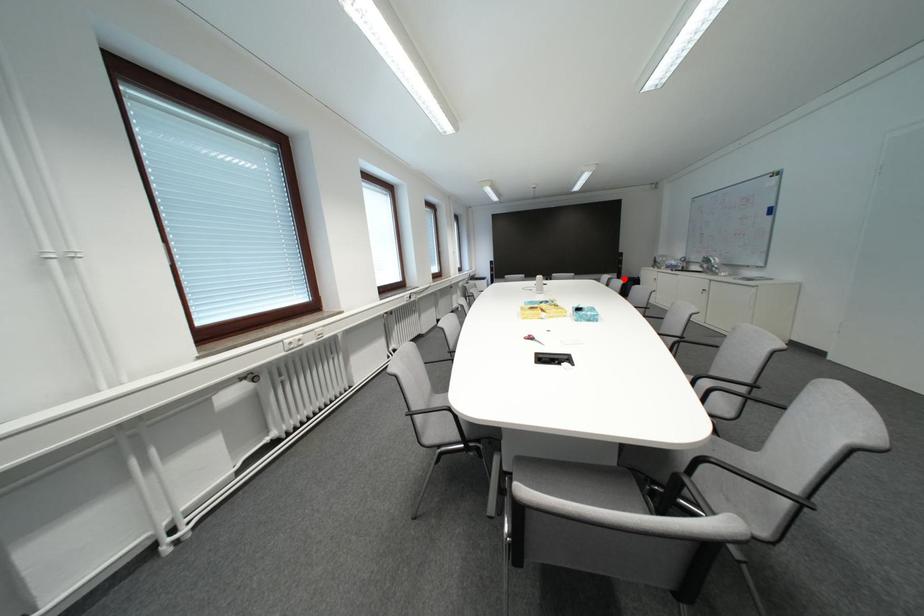
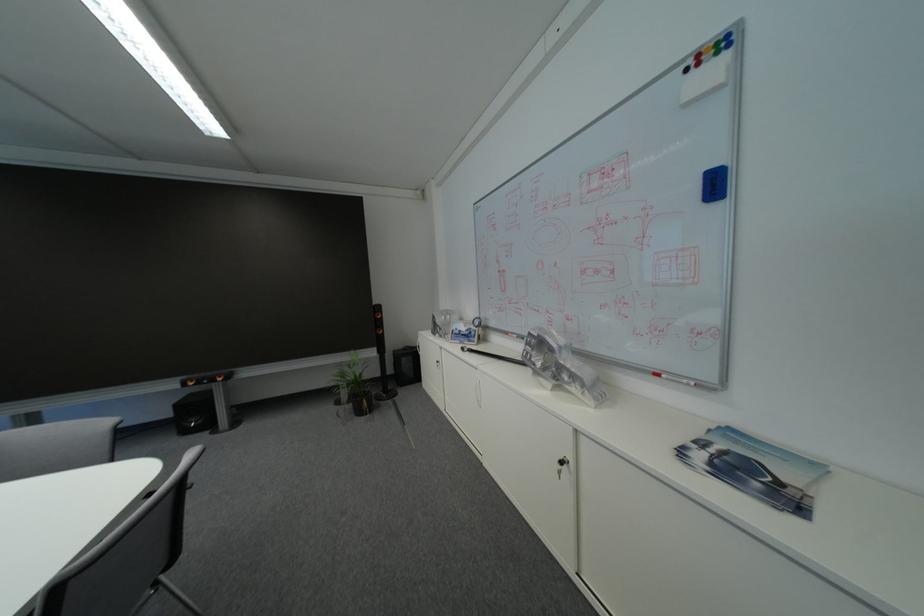
Locate, in the second image, the point that corresponds to the highlighted location in the first image.

(382, 355)